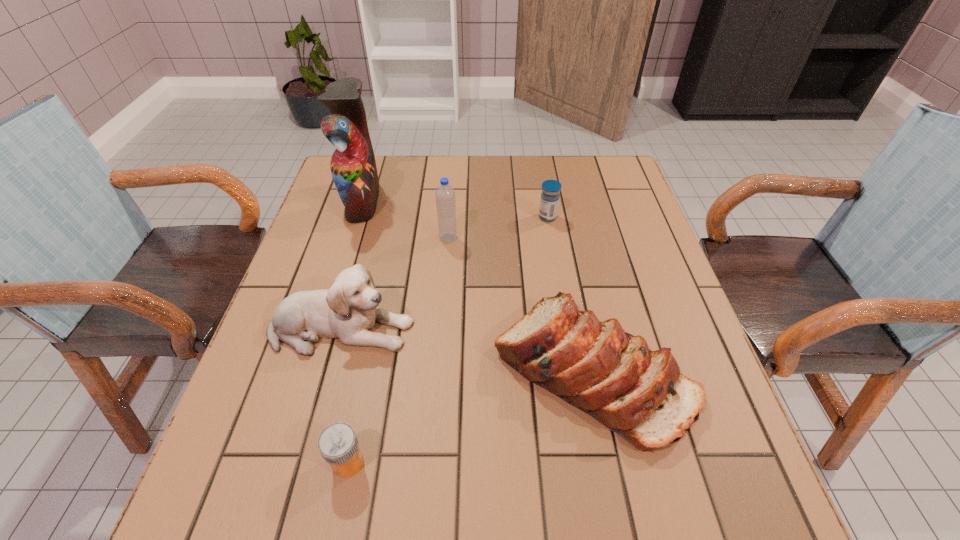
Where is `vacant space situated on the front of the third object from right to left`? This screenshot has width=960, height=540. vacant space situated on the front of the third object from right to left is located at coordinates (445, 269).

The width and height of the screenshot is (960, 540). In order to click on free space located 0.240m on the front-facing side of the puppy in this screenshot , I will do `click(527, 329)`.

The image size is (960, 540). Find the location of `free location located 0.220m on the left of the bread`. free location located 0.220m on the left of the bread is located at coordinates (382, 372).

Find the location of a particular element. The image size is (960, 540). free location located on the left of the farther medicine is located at coordinates (449, 217).

Locate an element on the screen. This screenshot has width=960, height=540. free space located on the label side of the shorter medicine is located at coordinates (472, 462).

Image resolution: width=960 pixels, height=540 pixels. In order to click on object situated at the far edge in this screenshot , I will do `click(353, 167)`.

Identify the location of object that is at the near edge. The height and width of the screenshot is (540, 960). (338, 444).

The height and width of the screenshot is (540, 960). I want to click on parrot at the left edge, so click(353, 167).

The image size is (960, 540). I want to click on puppy present at the left edge, so click(x=348, y=310).

At what (x,y) coordinates should I click in order to perform the action: click on object present at the right edge. Please return your answer as a coordinate pair (x, y). Looking at the image, I should click on (613, 376).